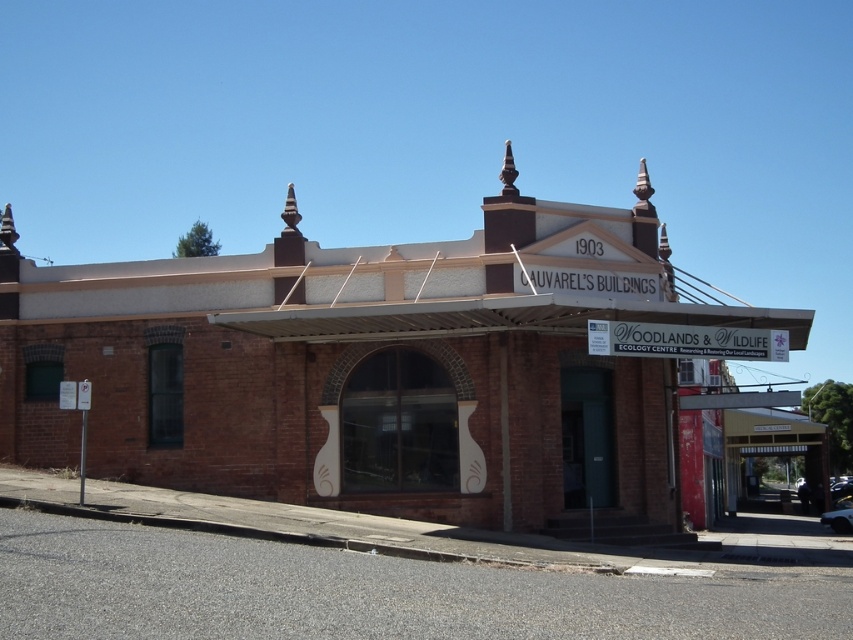
Image resolution: width=853 pixels, height=640 pixels. Describe the element at coordinates (381, 368) in the screenshot. I see `brown brick building at center` at that location.

Does brown brick building at center have a greater height compared to brown wooden canopy at lower right?

Correct, brown brick building at center is much taller as brown wooden canopy at lower right.

Image resolution: width=853 pixels, height=640 pixels. In order to click on brown brick building at center in this screenshot , I will do `click(381, 368)`.

At what (x,y) coordinates should I click in order to perform the action: click on brown brick building at center. Please return your answer as a coordinate pair (x, y). This screenshot has height=640, width=853. Looking at the image, I should click on (381, 368).